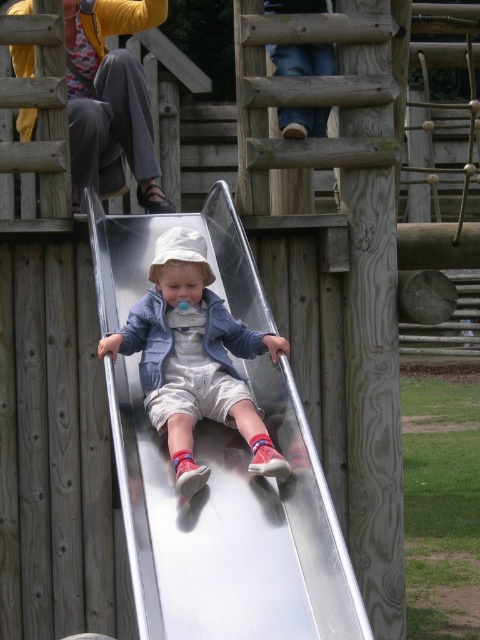
Question: Is silver metallic slide at center bigger than metallic silver slide at center?

Choices:
 (A) yes
 (B) no

Answer: (A)

Question: Which point is farther to the camera?

Choices:
 (A) silver metallic slide at center
 (B) metallic silver slide at center

Answer: (B)

Question: Can you confirm if silver metallic slide at center is smaller than metallic silver slide at center?

Choices:
 (A) yes
 (B) no

Answer: (B)

Question: Does silver metallic slide at center appear on the left side of metallic silver slide at center?

Choices:
 (A) yes
 (B) no

Answer: (A)

Question: Which point is closer to the camera?

Choices:
 (A) (257, 541)
 (B) (283, 464)

Answer: (A)